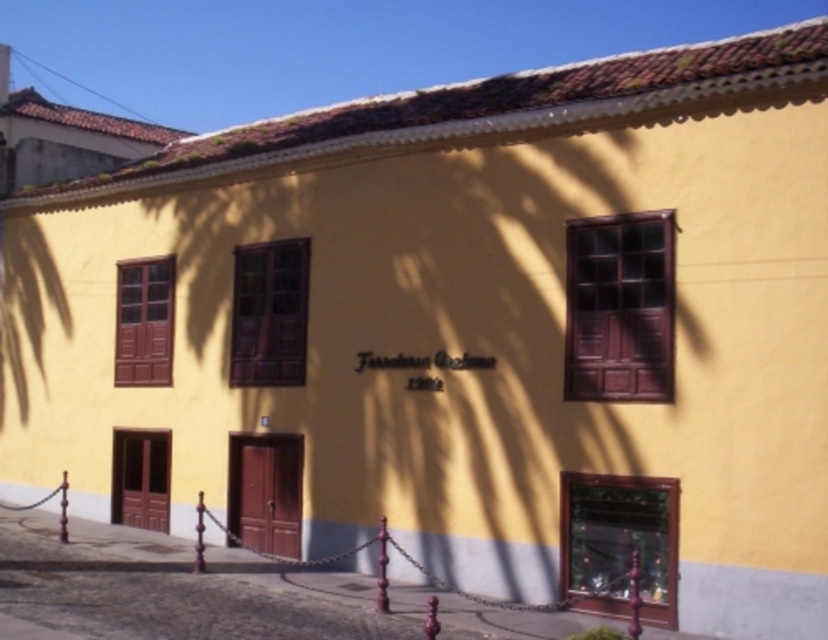
You are standing in front of the two story building and want to know which of the two points, point [621,364] or point [301,314], is closer to you. Which one is closer?

Point [621,364] is closer to the viewer than point [301,314].

You are standing in front of the Ferreteria Orde?o building and notice two windows. One is the matte brown wooden window at center and the other is the matte wood window at left. Which of these two windows is positioned more to the right side of the building?

The matte brown wooden window at center is positioned more to the right side of the building compared to the matte wood window at left.

You are a painter who needs to place a ladder between the matte brown wooden window at center and the matte wood window at left to paint the building. The ladder is 3 meters long. Will the ladder fit between them?

The distance between the matte brown wooden window at center and the matte wood window at left is 2.78 meters, so the 3 meter ladder will fit between them since it is longer than the distance between the two windows.